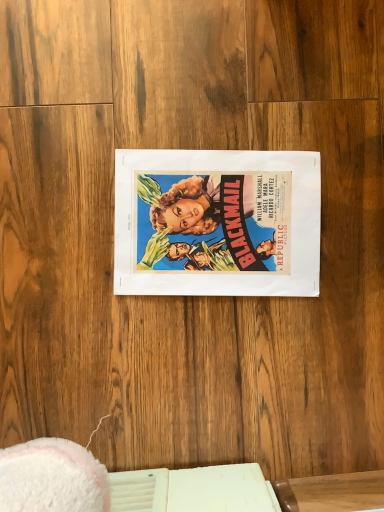
Question: From a real-world perspective, is vibrant paper poster at center below wooden table at center?

Choices:
 (A) no
 (B) yes

Answer: (B)

Question: Does vibrant paper poster at center have a greater width compared to wooden table at center?

Choices:
 (A) yes
 (B) no

Answer: (A)

Question: Considering the relative sizes of vibrant paper poster at center and wooden table at center in the image provided, is vibrant paper poster at center smaller than wooden table at center?

Choices:
 (A) yes
 (B) no

Answer: (B)

Question: Can you confirm if vibrant paper poster at center is bigger than wooden table at center?

Choices:
 (A) no
 (B) yes

Answer: (B)

Question: Does vibrant paper poster at center have a lesser width compared to wooden table at center?

Choices:
 (A) no
 (B) yes

Answer: (A)

Question: Could wooden table at center be considered to be inside vibrant paper poster at center?

Choices:
 (A) yes
 (B) no

Answer: (B)

Question: Is wooden table at center taller than vibrant paper poster at center?

Choices:
 (A) no
 (B) yes

Answer: (B)

Question: Does wooden table at center come in front of vibrant paper poster at center?

Choices:
 (A) no
 (B) yes

Answer: (B)

Question: From the image's perspective, is wooden table at center below vibrant paper poster at center?

Choices:
 (A) no
 (B) yes

Answer: (B)

Question: Is wooden table at center thinner than vibrant paper poster at center?

Choices:
 (A) no
 (B) yes

Answer: (B)

Question: From a real-world perspective, is wooden table at center over vibrant paper poster at center?

Choices:
 (A) no
 (B) yes

Answer: (B)

Question: Is wooden table at center next to vibrant paper poster at center?

Choices:
 (A) no
 (B) yes

Answer: (A)

Question: Considering the positions of wooden table at center and vibrant paper poster at center in the image, is wooden table at center taller or shorter than vibrant paper poster at center?

Choices:
 (A) short
 (B) tall

Answer: (B)